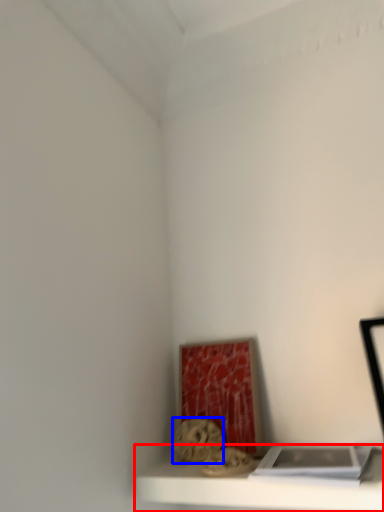
Question: Which point is further to the camera, shelf (highlighted by a red box) or art (highlighted by a blue box)?

Choices:
 (A) shelf
 (B) art

Answer: (B)